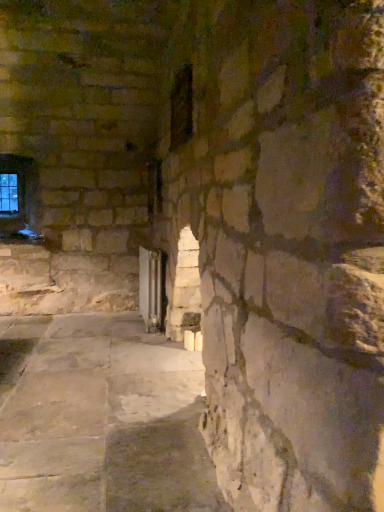
Describe the element at coordinates (151, 288) in the screenshot. I see `transparent glass door at center` at that location.

Where is `clear glass window at upper left, which is the second window in front-to-back order`? The width and height of the screenshot is (384, 512). clear glass window at upper left, which is the second window in front-to-back order is located at coordinates (9, 193).

The height and width of the screenshot is (512, 384). I want to click on dark glass window at center, placed as the 1th window when sorted from front to back, so click(x=181, y=106).

Considering the relative sizes of clear glass window at upper left, the 1th window from the back, and dark glass window at center, marked as the 1th window in a right-to-left arrangement, in the image provided, is clear glass window at upper left, the 1th window from the back, taller than dark glass window at center, marked as the 1th window in a right-to-left arrangement,?

Correct, clear glass window at upper left, the 1th window from the back, is much taller as dark glass window at center, marked as the 1th window in a right-to-left arrangement.

Find the location of a particular element. The height and width of the screenshot is (512, 384). window behind the dark glass window at center, the second window positioned from the back is located at coordinates (9, 193).

Is point (9, 174) positioned after point (186, 133)?

Yes, point (9, 174) is behind point (186, 133).

Could you tell me if dark glass window at center, marked as the 2th window in a left-to-right arrangement, is facing clear glass window at upper left, the first window when ordered from left to right?

No, dark glass window at center, marked as the 2th window in a left-to-right arrangement, is not facing towards clear glass window at upper left, the first window when ordered from left to right.

Identify the location of window behind the dark glass window at center, placed as the 1th window when sorted from front to back. This screenshot has width=384, height=512. (9, 193).

From a real-world perspective, does dark glass window at center, marked as the 1th window in a right-to-left arrangement, stand above clear glass window at upper left, the 2th window when ordered from right to left?

Yes, from a real-world perspective, dark glass window at center, marked as the 1th window in a right-to-left arrangement, is above clear glass window at upper left, the 2th window when ordered from right to left.

Between point (173, 136) and point (15, 181), which one is positioned in front?

The point (173, 136) is more forward.

From a real-world perspective, relative to clear glass window at upper left, the first window when ordered from left to right, is transparent glass door at center vertically above or below?

Clearly, from a real-world perspective, transparent glass door at center is below clear glass window at upper left, the first window when ordered from left to right.

Who is smaller, transparent glass door at center or clear glass window at upper left, which is the second window in front-to-back order?

With smaller size is clear glass window at upper left, which is the second window in front-to-back order.

Is transparent glass door at center aimed at clear glass window at upper left, the first window when ordered from left to right?

No, transparent glass door at center is not aimed at clear glass window at upper left, the first window when ordered from left to right.

Between transparent glass door at center and clear glass window at upper left, the 1th window from the back, which one has smaller width?

clear glass window at upper left, the 1th window from the back, is thinner.

Which is behind, point (176, 89) or point (144, 318)?

Point (144, 318)

From the image's perspective, is dark glass window at center, the second window positioned from the back, above transparent glass door at center?

Yes.

Is dark glass window at center, marked as the 2th window in a left-to-right arrangement, completely or partially outside of transparent glass door at center?

dark glass window at center, marked as the 2th window in a left-to-right arrangement, is positioned outside transparent glass door at center.

Is clear glass window at upper left, the first window when ordered from left to right, not within transparent glass door at center?

Yes.

Relative to transparent glass door at center, is clear glass window at upper left, the first window when ordered from left to right, in front or behind?

In the image, clear glass window at upper left, the first window when ordered from left to right, appears behind transparent glass door at center.

Considering the relative positions of clear glass window at upper left, the first window when ordered from left to right, and transparent glass door at center in the image provided, is clear glass window at upper left, the first window when ordered from left to right, to the right of transparent glass door at center from the viewer's perspective?

No.

In order to click on window lying on the left of transparent glass door at center in this screenshot , I will do `click(9, 193)`.

Considering the positions of objects transparent glass door at center and dark glass window at center, placed as the 1th window when sorted from front to back, in the image provided, who is behind, transparent glass door at center or dark glass window at center, placed as the 1th window when sorted from front to back,?

transparent glass door at center.

Based on the photo, from a real-world perspective, is transparent glass door at center over dark glass window at center, placed as the 1th window when sorted from front to back?

No, from a real-world perspective, transparent glass door at center is not above dark glass window at center, placed as the 1th window when sorted from front to back.

I want to click on glass door on the left side of dark glass window at center, the second window positioned from the back, so click(x=151, y=288).

Is transparent glass door at center completely or partially outside of dark glass window at center, placed as the 1th window when sorted from front to back?

transparent glass door at center lies outside dark glass window at center, placed as the 1th window when sorted from front to back,'s area.

This screenshot has height=512, width=384. What are the coordinates of `window below the dark glass window at center, the second window positioned from the back (from the image's perspective)` in the screenshot? It's located at (9, 193).

Where is `window above the clear glass window at upper left, the first window when ordered from left to right (from a real-world perspective)`? Image resolution: width=384 pixels, height=512 pixels. window above the clear glass window at upper left, the first window when ordered from left to right (from a real-world perspective) is located at coordinates (181, 106).

Looking at the image, which one is located further to transparent glass door at center, clear glass window at upper left, the 1th window from the back, or dark glass window at center, marked as the 1th window in a right-to-left arrangement?

clear glass window at upper left, the 1th window from the back, is further to transparent glass door at center.

Looking at the image, which one is located further to dark glass window at center, placed as the 1th window when sorted from front to back, transparent glass door at center or clear glass window at upper left, the 1th window from the back?

Among the two, clear glass window at upper left, the 1th window from the back, is located further to dark glass window at center, placed as the 1th window when sorted from front to back.

When comparing their distances from clear glass window at upper left, the 2th window when ordered from right to left, does transparent glass door at center or dark glass window at center, the second window positioned from the back, seem further?

dark glass window at center, the second window positioned from the back.

From the image, which object appears to be nearer to transparent glass door at center, dark glass window at center, marked as the 2th window in a left-to-right arrangement, or clear glass window at upper left, which is the second window in front-to-back order?

dark glass window at center, marked as the 2th window in a left-to-right arrangement, is positioned closer to the anchor transparent glass door at center.

Considering their positions, is dark glass window at center, the second window positioned from the back, positioned further to clear glass window at upper left, the first window when ordered from left to right, than transparent glass door at center?

dark glass window at center, the second window positioned from the back.

From the picture: Based on their spatial positions, is clear glass window at upper left, the 1th window from the back, or transparent glass door at center further from dark glass window at center, marked as the 2th window in a left-to-right arrangement?

clear glass window at upper left, the 1th window from the back, lies further to dark glass window at center, marked as the 2th window in a left-to-right arrangement, than the other object.

Identify the location of glass door between dark glass window at center, placed as the 1th window when sorted from front to back, and clear glass window at upper left, the 1th window from the back, along the z-axis. The image size is (384, 512). (151, 288).